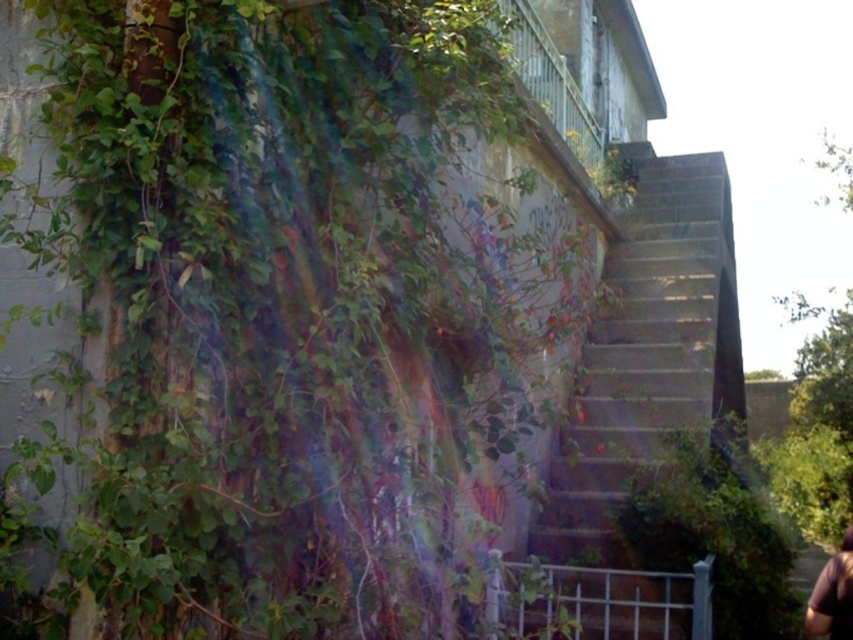
Question: Which object is the closest to the green leafy plant at lower right?

Choices:
 (A) concrete stairs at center
 (B) brown fabric at lower right

Answer: (A)

Question: Is the position of green leafy plant at upper left more distant than that of brown fabric at lower right?

Choices:
 (A) yes
 (B) no

Answer: (B)

Question: Is green leafy plant at upper left bigger than brown fabric at lower right?

Choices:
 (A) no
 (B) yes

Answer: (B)

Question: Can you confirm if green leafy plant at upper left is positioned to the left of brown fabric at lower right?

Choices:
 (A) no
 (B) yes

Answer: (B)

Question: Considering the real-world distances, which object is closest to the brown fabric at lower right?

Choices:
 (A) green leafy plant at upper left
 (B) concrete stairs at center

Answer: (A)

Question: Among these points, which one is farthest from the camera?

Choices:
 (A) (630, 456)
 (B) (850, 547)

Answer: (A)